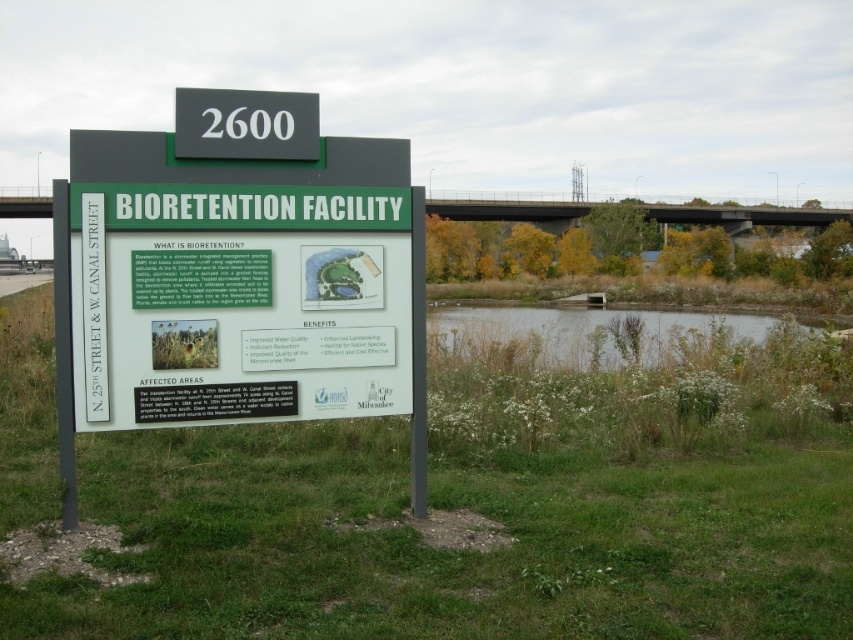
Is green grass at center above green plastic sign at center?

Incorrect, green grass at center is not positioned above green plastic sign at center.

Does green grass at center have a lesser width compared to green plastic sign at center?

Incorrect, green grass at center's width is not less than green plastic sign at center's.

Locate an element on the screen. The height and width of the screenshot is (640, 853). green grass at center is located at coordinates (450, 552).